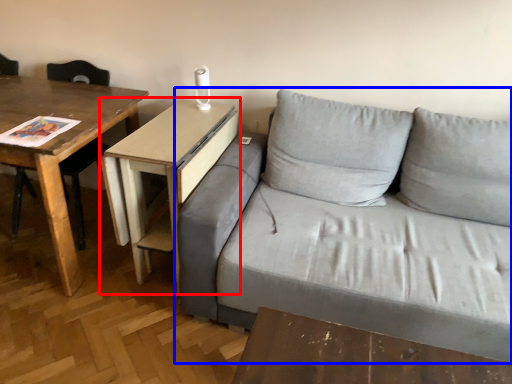
Question: Among these objects, which one is farthest to the camera, table (highlighted by a red box) or studio couch (highlighted by a blue box)?

Choices:
 (A) table
 (B) studio couch

Answer: (A)